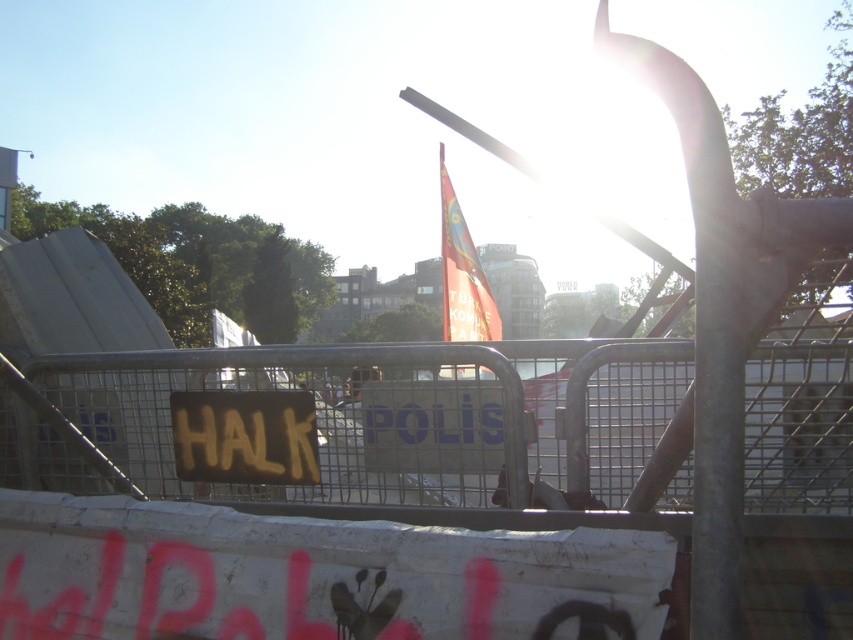
You are standing at the point where the image was taken. You want to walk towards the metallic silver fence at center. In which direction should you walk?

Walk towards the center of the image to reach the metallic silver fence at center.

You are a delivery person with a 36 inch wide box. You need to pass through the space between the yellow painted sign at center and the red fabric flag at center. Can your box fit through that space?

The space between the yellow painted sign at center and the red fabric flag at center is 36.69 inches. Since your box is 36 inches wide, it can fit through the space as there is enough clearance.